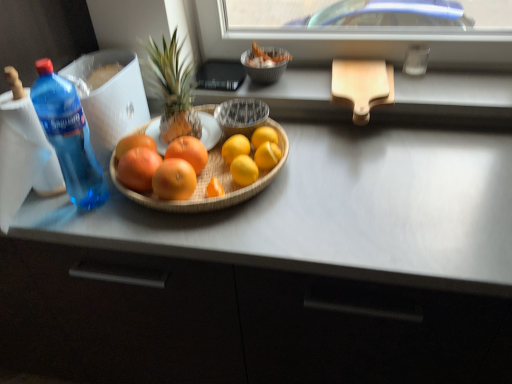
This screenshot has width=512, height=384. In order to click on vacant area that is in front of yellow matte grapefruit at center, arranged as the first grapefruit when viewed from the right in this screenshot , I will do `click(252, 227)`.